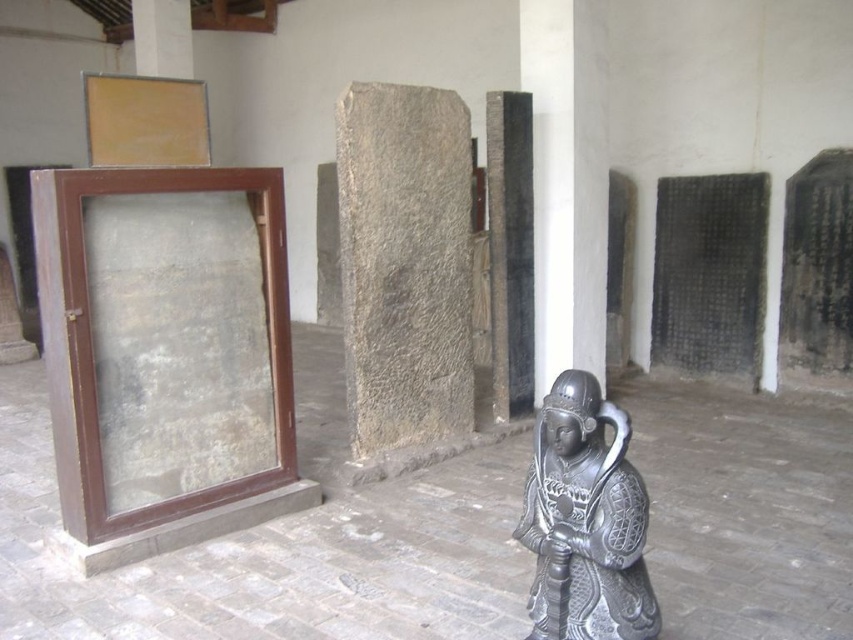
Is point (381, 198) in front of point (531, 131)?

Yes.

Does gray stone pillar at center have a larger size compared to black polished stone pillar at center?

Correct, gray stone pillar at center is larger in size than black polished stone pillar at center.

Which is behind, point (389, 394) or point (529, 305)?

Point (529, 305)

Find the location of `gray stone pillar at center`. gray stone pillar at center is located at coordinates [x=404, y=262].

At what (x,y) coordinates should I click in order to perform the action: click on gray stone pillar at center. Please return your answer as a coordinate pair (x, y). Image resolution: width=853 pixels, height=640 pixels. Looking at the image, I should click on (404, 262).

Who is positioned more to the left, polished bronze statue at center or white stone pillar at upper left?

white stone pillar at upper left is more to the left.

Can you confirm if polished bronze statue at center is positioned above white stone pillar at upper left?

Actually, polished bronze statue at center is below white stone pillar at upper left.

Does point (546, 579) lie behind point (160, 42)?

No, (546, 579) is closer to viewer.

Find the location of `polished bronze statue at center`. polished bronze statue at center is located at coordinates point(585,520).